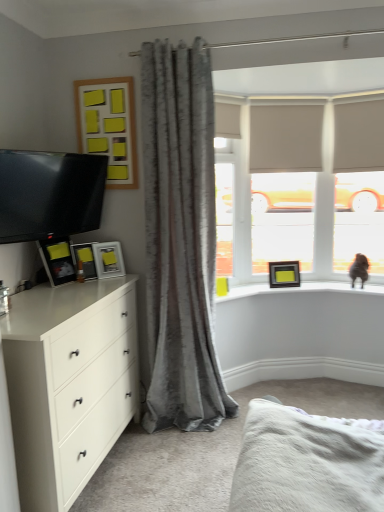
Locate an element on the screen. This screenshot has height=512, width=384. vacant area that lies in front of matte black picture frame at left, which is counted as the 3th picture frame, starting from the back is located at coordinates (89, 285).